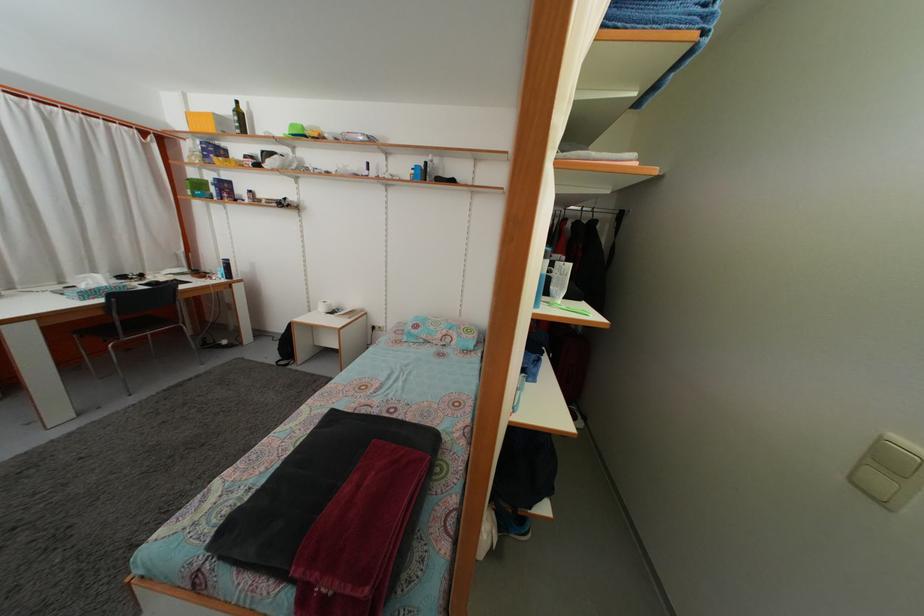
You are a GUI agent. You are given a task and a screenshot of the screen. Output one action in this format:
    pyautogui.click(x=<x>, y=<y>)
    Task: Click on the blue spray bottle
    Image resolution: width=924 pixels, height=616 pixels.
    Given the screenshot: What is the action you would take?
    pyautogui.click(x=417, y=172)